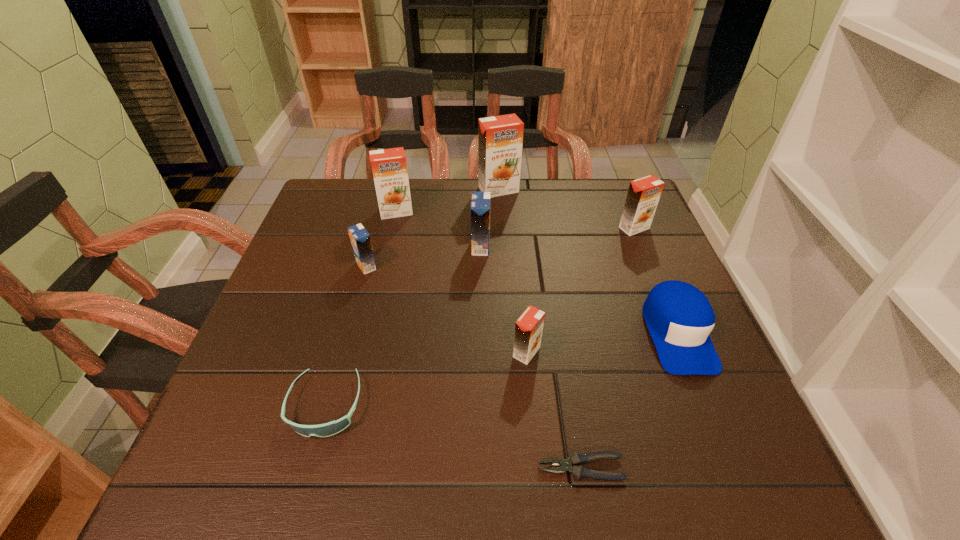
Find the location of a particular element. free space located 0.300m on the front of the rightmost orange juice is located at coordinates [x=673, y=323].

The height and width of the screenshot is (540, 960). I want to click on vacant space located on the right of the left blue orange_juice, so click(471, 266).

At what (x,y) coordinates should I click in order to perform the action: click on free space located 0.250m on the left of the smallest orange orange juice. Please return your answer as a coordinate pair (x, y). Looking at the image, I should click on (390, 352).

At what (x,y) coordinates should I click in order to perform the action: click on free space located on the front-facing side of the blue baseball cap. Please return your answer as a coordinate pair (x, y). This screenshot has width=960, height=540. Looking at the image, I should click on (731, 465).

The image size is (960, 540). I want to click on vacant point located on the front-facing side of the goggles, so click(302, 490).

Where is `free spot located 0.320m at the gripping part of the nearest object`? free spot located 0.320m at the gripping part of the nearest object is located at coordinates (346, 468).

I want to click on free location located 0.170m at the gripping part of the nearest object, so click(x=436, y=468).

Where is `blank space located at the gripping part of the nearest object`? The width and height of the screenshot is (960, 540). blank space located at the gripping part of the nearest object is located at coordinates (309, 468).

Find the location of a particular element. goggles located at the near edge is located at coordinates (331, 428).

You are a GUI agent. You are given a task and a screenshot of the screen. Output one action in this format:
    pyautogui.click(x=<x>, y=<y>)
    Task: Click on the pliers present at the near edge
    The width and height of the screenshot is (960, 540).
    Given the screenshot: What is the action you would take?
    pyautogui.click(x=575, y=460)